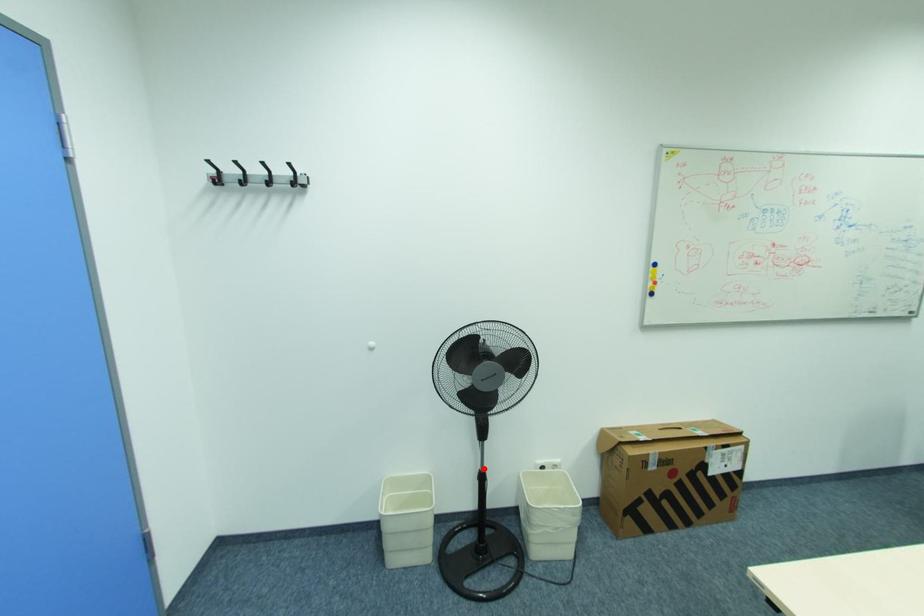
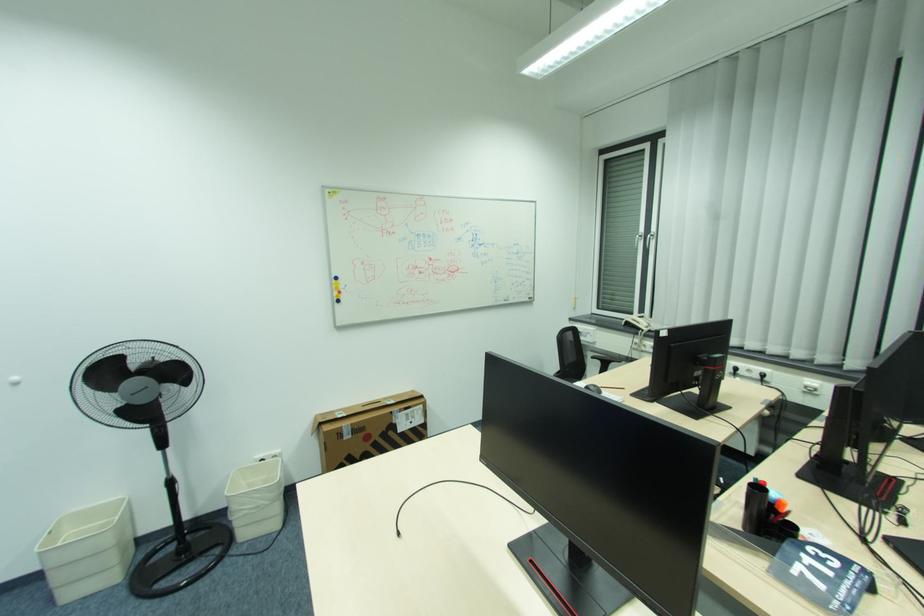
The point at the highlighted location is marked in the first image. Where is the corresponding point in the second image?

(169, 477)